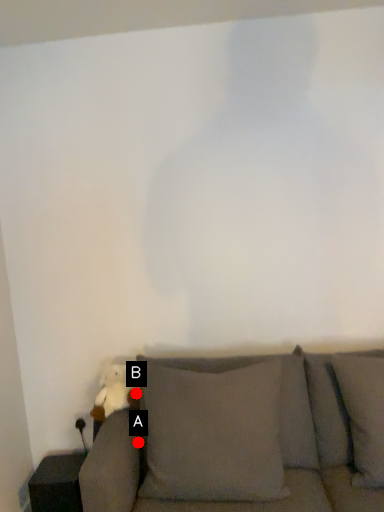
Question: Two points are circled on the image, labeled by A and B beside each circle. Which point is further to the camera?

Choices:
 (A) A is further
 (B) B is further

Answer: (B)